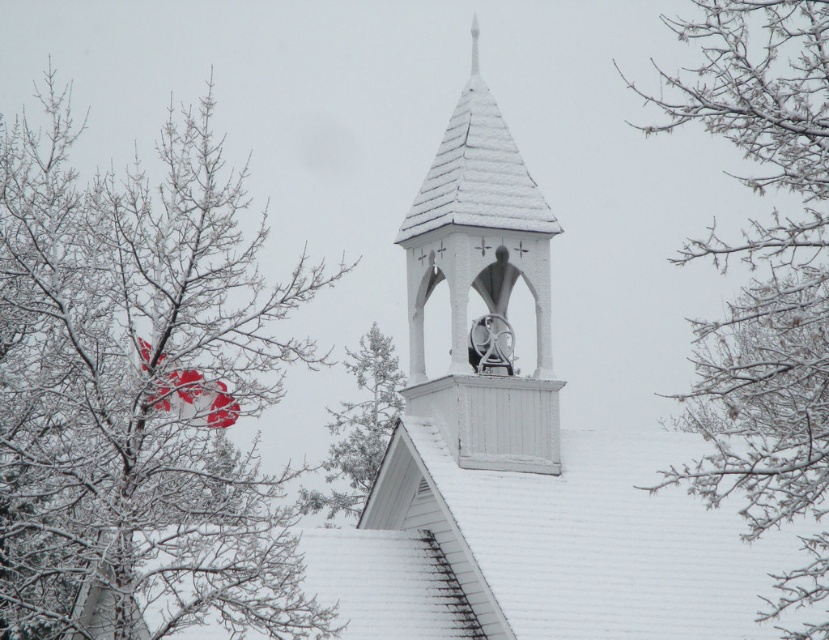
Question: Which object is the closest to the snow-covered branches at left?

Choices:
 (A) white wooden bell tower at upper center
 (B) snow-covered branches at upper center

Answer: (A)

Question: Which point is farther from the camera taking this photo?

Choices:
 (A) (342, 420)
 (B) (682, 257)

Answer: (B)

Question: Does snow-covered branches at left come in front of green textured pine tree at upper center?

Choices:
 (A) no
 (B) yes

Answer: (B)

Question: Can you confirm if white wooden bell tower at upper center is bigger than green textured pine tree at upper center?

Choices:
 (A) no
 (B) yes

Answer: (B)

Question: Which object is positioned closest to the green textured pine tree at upper center?

Choices:
 (A) white wooden bell tower at upper center
 (B) snow-covered branches at left

Answer: (B)

Question: Is white wooden bell tower at upper center wider than green textured pine tree at upper center?

Choices:
 (A) yes
 (B) no

Answer: (A)